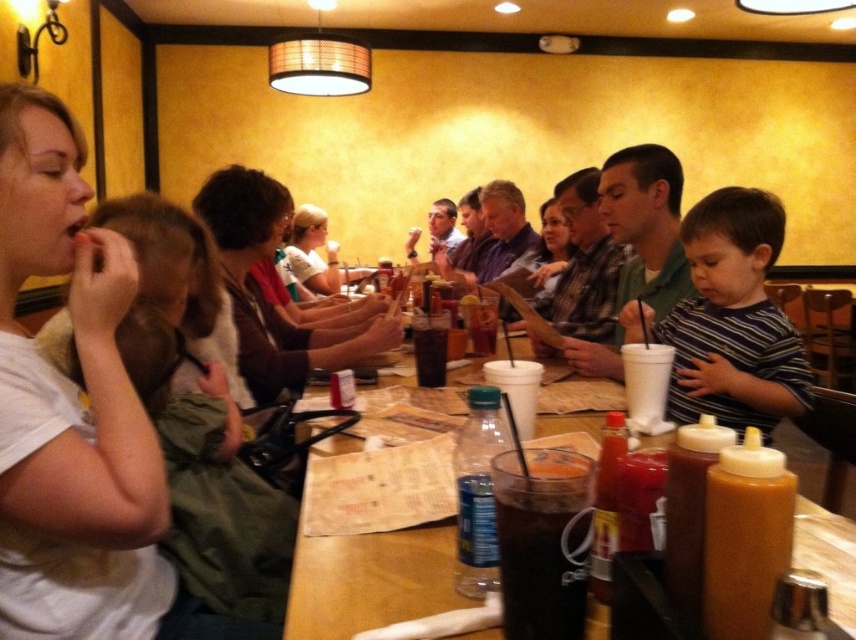
This screenshot has height=640, width=856. What do you see at coordinates (635, 250) in the screenshot?
I see `green plaid shirt at center` at bounding box center [635, 250].

Can you confirm if green plaid shirt at center is thinner than matte white shirt at center?

No, green plaid shirt at center is not thinner than matte white shirt at center.

This screenshot has height=640, width=856. Describe the element at coordinates (635, 250) in the screenshot. I see `green plaid shirt at center` at that location.

At what (x,y) coordinates should I click in order to perform the action: click on green plaid shirt at center. Please return your answer as a coordinate pair (x, y). Looking at the image, I should click on pos(635,250).

Between dark brown plastic cup at center and translucent glass cup at table center, which one has more height?

With more height is translucent glass cup at table center.

Between point (566, 602) and point (418, 321), which one is positioned behind?

The point (418, 321) is more distant.

Is point (563, 632) positioned behind point (420, 374)?

That is False.

Image resolution: width=856 pixels, height=640 pixels. Find the location of `dark brown plastic cup at center`. dark brown plastic cup at center is located at coordinates (542, 564).

Is point (321, 564) positioned before point (230, 202)?

Yes, point (321, 564) is closer to viewer.

In the scene shown: Can you confirm if wooden table at center is thinner than matte brown shirt at center?

Yes.

Describe the element at coordinates (370, 580) in the screenshot. Image resolution: width=856 pixels, height=640 pixels. I see `wooden table at center` at that location.

Identify the location of wooden table at center. The image size is (856, 640). (370, 580).